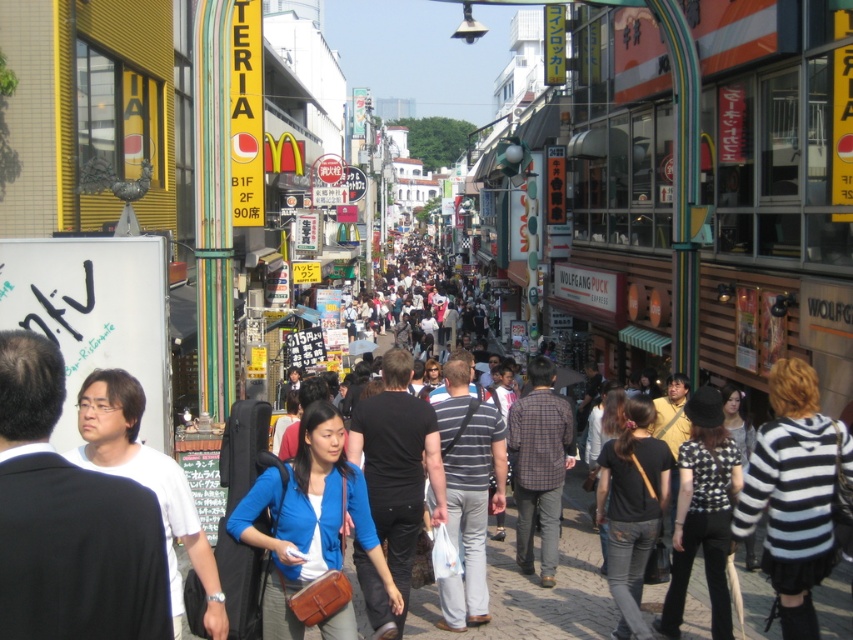
Who is lower down, black matte shirt at center or plaid shirt at center?

black matte shirt at center is lower down.

Can you confirm if black matte shirt at center is positioned to the right of plaid shirt at center?

No, black matte shirt at center is not to the right of plaid shirt at center.

Does point (393, 468) come behind point (543, 465)?

No, (393, 468) is closer to viewer.

Where is `black matte shirt at center`? black matte shirt at center is located at coordinates (393, 483).

Is point (386, 486) closer to camera compared to point (125, 444)?

No, (386, 486) is further to viewer.

Is point (370, 582) closer to viewer compared to point (106, 426)?

That is False.

In order to click on black matte shirt at center in this screenshot , I will do `click(393, 483)`.

Which is below, black and white checkered shirt at center or plaid shirt at center?

black and white checkered shirt at center

Who is more distant from viewer, (714, 417) or (531, 486)?

The point (531, 486) is more distant.

Locate an element on the screen. Image resolution: width=853 pixels, height=640 pixels. black and white checkered shirt at center is located at coordinates (701, 513).